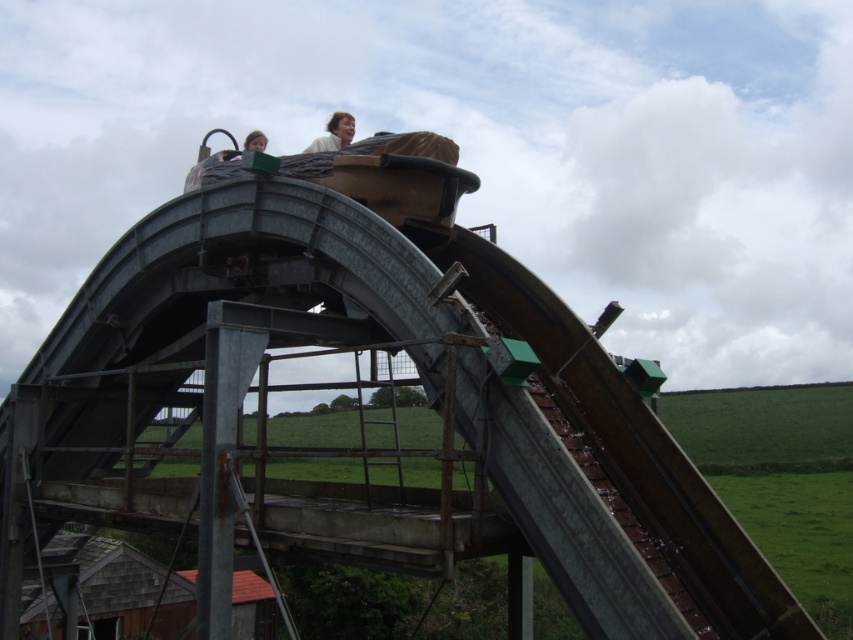
Is light brown hair at upper center bigger than matte black helmet at upper center?

Incorrect, light brown hair at upper center is not larger than matte black helmet at upper center.

Locate an element on the screen. Image resolution: width=853 pixels, height=640 pixels. light brown hair at upper center is located at coordinates (334, 132).